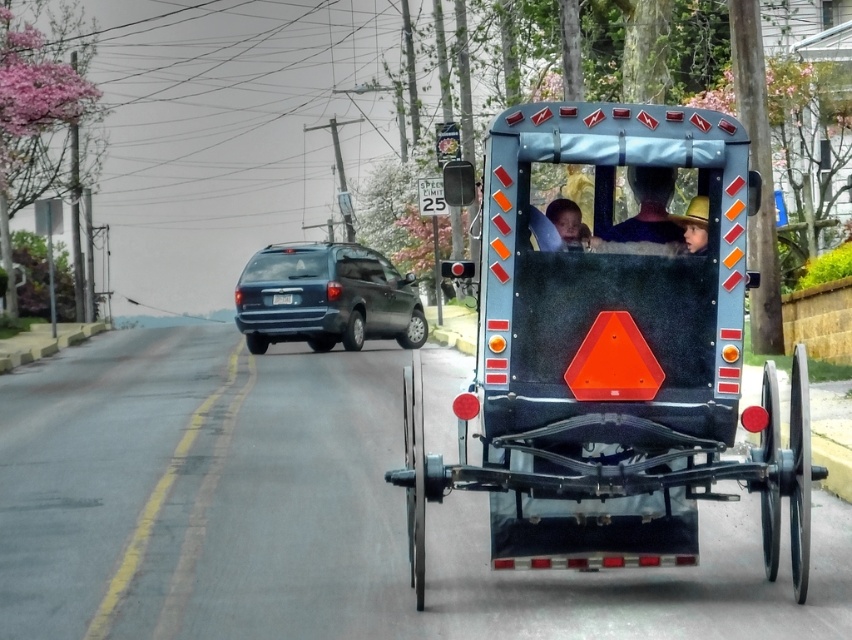
Can you confirm if glossy metallic suv at center is positioned to the right of blue fabric hat at center?

Incorrect, glossy metallic suv at center is not on the right side of blue fabric hat at center.

Who is shorter, glossy metallic suv at center or blue fabric hat at center?

blue fabric hat at center

Locate an element on the screen. glossy metallic suv at center is located at coordinates (326, 298).

Does point (353, 340) lie in front of point (704, 212)?

No, it is not.

What do you see at coordinates (326, 298) in the screenshot? I see `glossy metallic suv at center` at bounding box center [326, 298].

I want to click on glossy metallic suv at center, so click(x=326, y=298).

Which of these two, metallic blue rickshaw at center or glossy metallic suv at center, stands shorter?

glossy metallic suv at center

Is metallic blue rickshaw at center smaller than glossy metallic suv at center?

Indeed, metallic blue rickshaw at center has a smaller size compared to glossy metallic suv at center.

This screenshot has width=852, height=640. What do you see at coordinates (613, 358) in the screenshot?
I see `metallic blue rickshaw at center` at bounding box center [613, 358].

Where is `metallic blue rickshaw at center`? The height and width of the screenshot is (640, 852). metallic blue rickshaw at center is located at coordinates (613, 358).